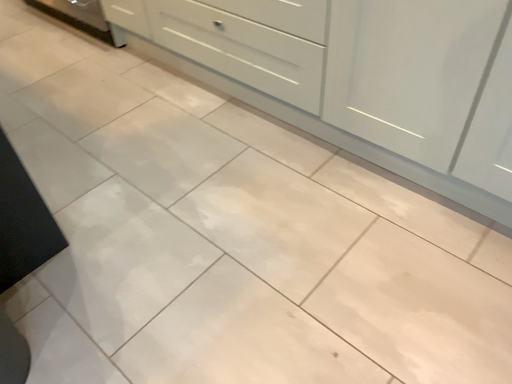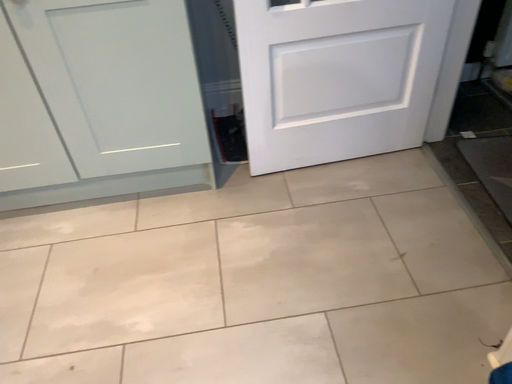
Question: How did the camera likely rotate when shooting the video?

Choices:
 (A) rotated left
 (B) rotated right

Answer: (B)